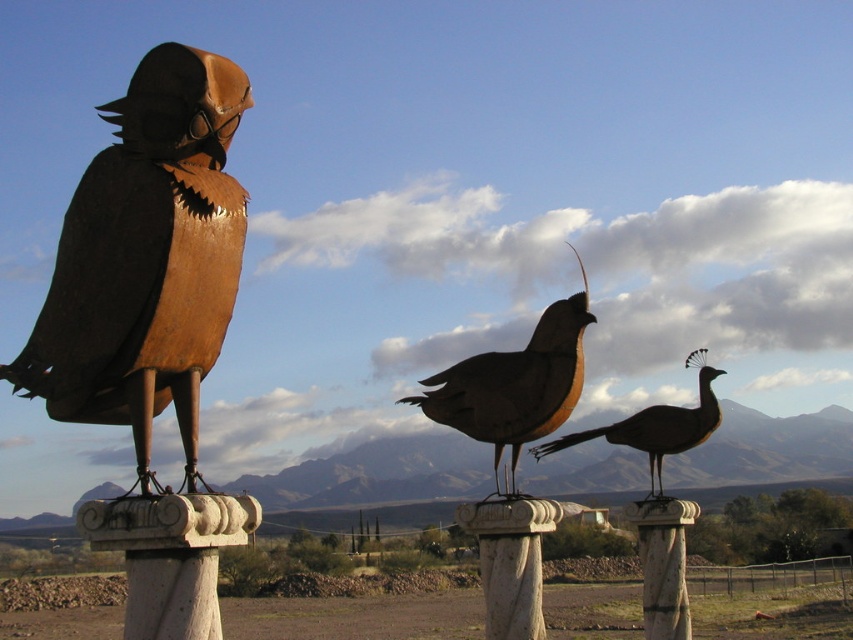
Question: Does rusty metal bird at left appear under brown matte bird at center?

Choices:
 (A) yes
 (B) no

Answer: (B)

Question: Is rusty metal bird at left to the right of shiny bronze peacock at center from the viewer's perspective?

Choices:
 (A) yes
 (B) no

Answer: (B)

Question: Which object is the farthest from the shiny bronze peacock at center?

Choices:
 (A) white marble pillar at center
 (B) rusty metal bird at left

Answer: (B)

Question: Considering the real-world distances, which object is closest to the rusty metal bird at left?

Choices:
 (A) brown matte bird at center
 (B) white marble pillar at center
 (C) shiny bronze peacock at center

Answer: (A)

Question: Which of the following is the closest to the observer?

Choices:
 (A) white marble pillar at center
 (B) brown matte bird at center
 (C) shiny bronze peacock at center
 (D) rusty metal bird at left

Answer: (D)

Question: Does white marble pillar at center appear on the right side of shiny bronze peacock at center?

Choices:
 (A) no
 (B) yes

Answer: (B)